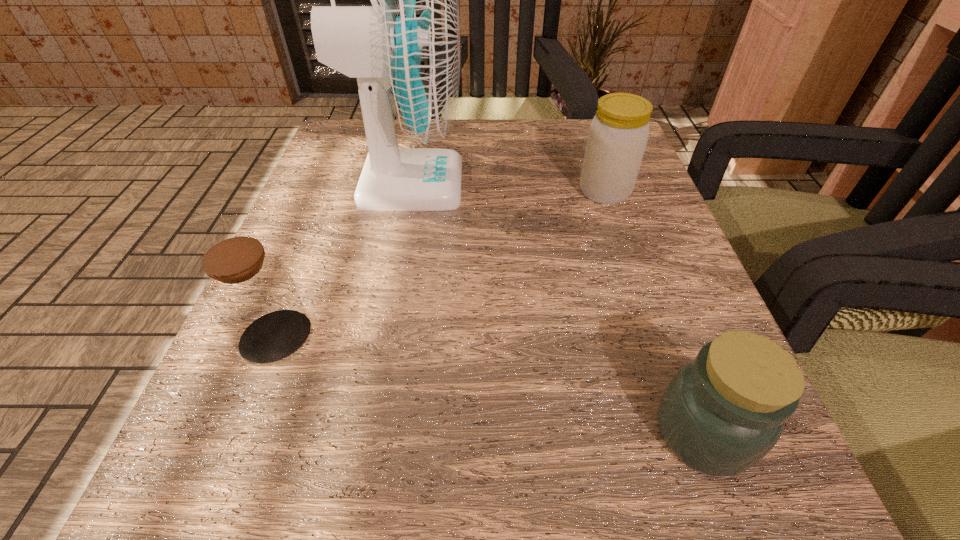
The height and width of the screenshot is (540, 960). In order to click on jar that is at the far edge in this screenshot , I will do `click(618, 134)`.

This screenshot has height=540, width=960. In order to click on object that is at the near edge in this screenshot , I will do `click(722, 412)`.

Image resolution: width=960 pixels, height=540 pixels. In order to click on fan at the left edge in this screenshot , I will do `click(404, 50)`.

Identify the location of jar that is positioned at the left edge. Image resolution: width=960 pixels, height=540 pixels. (251, 293).

Where is `object present at the far left corner`? object present at the far left corner is located at coordinates coord(404,50).

This screenshot has width=960, height=540. What are the coordinates of `object present at the far right corner` in the screenshot? It's located at (618, 134).

The width and height of the screenshot is (960, 540). Find the location of `object that is positioned at the near right corner`. object that is positioned at the near right corner is located at coordinates (722, 412).

In the image, there is a desktop. At what (x,y) coordinates should I click in order to perform the action: click on vacant space at the far edge. Please return your answer as a coordinate pair (x, y). The height and width of the screenshot is (540, 960). Looking at the image, I should click on (474, 151).

Image resolution: width=960 pixels, height=540 pixels. In order to click on free space at the near edge of the desktop in this screenshot , I will do `click(372, 495)`.

You are a GUI agent. You are given a task and a screenshot of the screen. Output one action in this format:
    pyautogui.click(x=<x>, y=<y>)
    Task: Click on the vacant space at the left edge of the desktop
    The height and width of the screenshot is (540, 960).
    Given the screenshot: What is the action you would take?
    pyautogui.click(x=309, y=303)